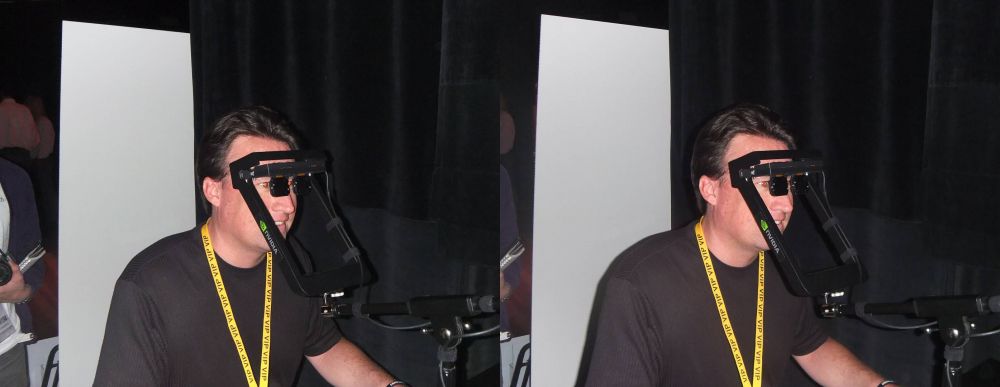
At what (x,y) coordinates should I click in order to perform the action: click on backdrop. Please return your answer as a coordinate pair (x, y). This screenshot has height=387, width=1000. Looking at the image, I should click on (123, 172), (605, 165).